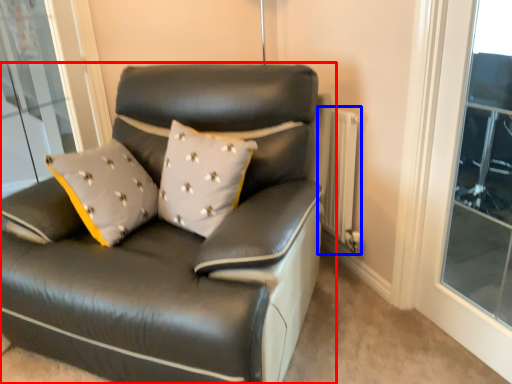
Question: Which point is closer to the camera, studio couch (highlighted by a red box) or radiator (highlighted by a blue box)?

Choices:
 (A) studio couch
 (B) radiator

Answer: (A)